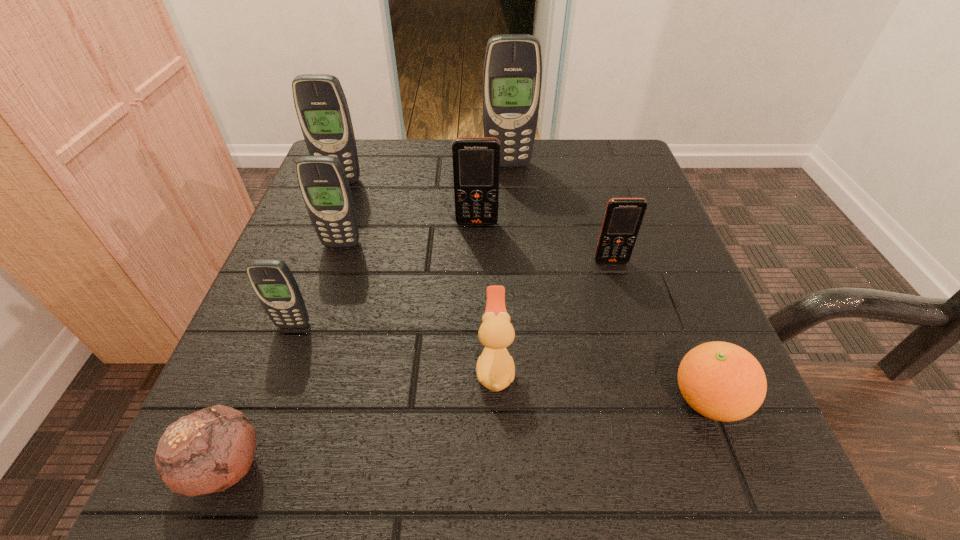
At what (x,y) coordinates should I click in order to perform the action: click on the farthest gray cellular telephone. Please return your answer as a coordinate pair (x, y). Looking at the image, I should click on (512, 76).

Where is `the farthest object`? This screenshot has height=540, width=960. the farthest object is located at coordinates (512, 76).

You are a GUI agent. You are given a task and a screenshot of the screen. Output one action in this format:
    pyautogui.click(x=<x>, y=<y>)
    Task: Click on the second tallest cellular telephone
    Image resolution: width=960 pixels, height=540 pixels.
    Given the screenshot: What is the action you would take?
    pyautogui.click(x=321, y=106)

What are the coordinates of `the second farthest gray cellular telephone` in the screenshot? It's located at (321, 106).

Locate an element on the screen. the second nearest gray cellular telephone is located at coordinates (324, 186).

This screenshot has height=540, width=960. I want to click on the fourth farthest object, so click(x=324, y=186).

Find the location of a particular element. The width and height of the screenshot is (960, 540). the left orange cellular telephone is located at coordinates (476, 160).

Identify the location of the third farthest object. (476, 160).

What are the coordinates of `the second nearest cellular telephone` in the screenshot? It's located at (623, 217).

Image resolution: width=960 pixels, height=540 pixels. What are the coordinates of `the rightmost cellular telephone` in the screenshot? It's located at (623, 217).